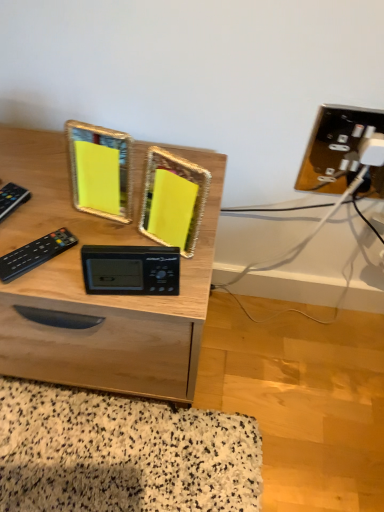
Identify the location of free spot behind black plastic remote at left, the first control viewed from the right. Image resolution: width=384 pixels, height=512 pixels. (49, 200).